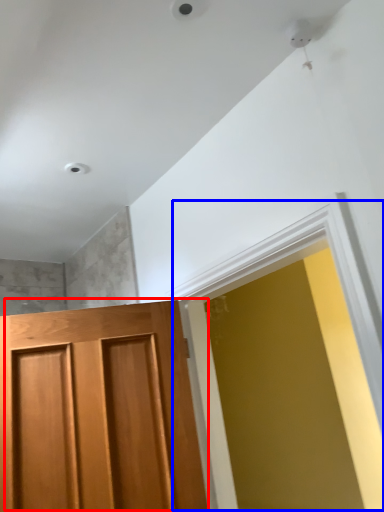
Question: Which point is further to the camera, door (highlighted by a red box) or window (highlighted by a blue box)?

Choices:
 (A) door
 (B) window

Answer: (A)